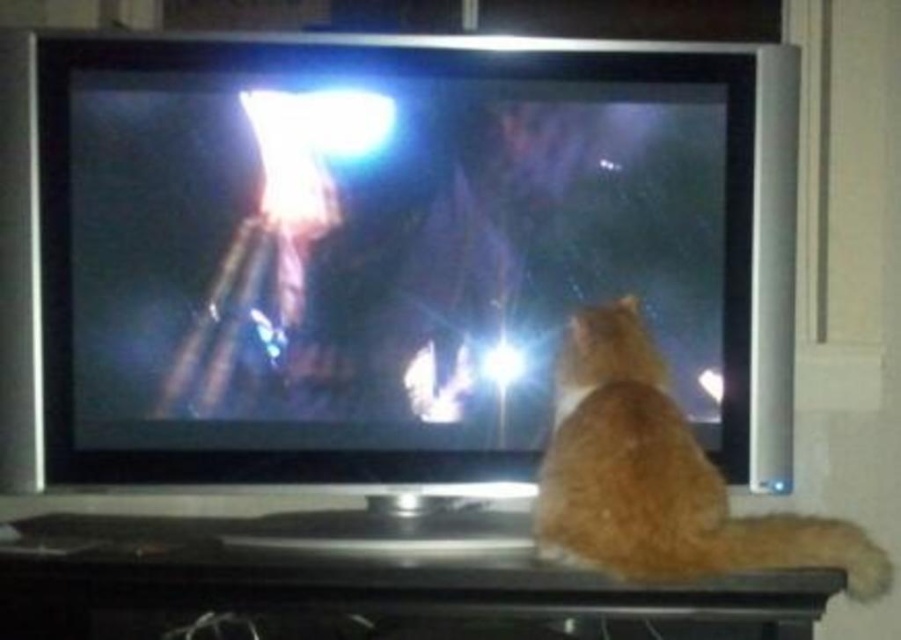
Question: Among these objects, which one is nearest to the camera?

Choices:
 (A) metallic silver flat at center
 (B) orange fur cat at lower right

Answer: (B)

Question: Among these points, which one is nearest to the camera?

Choices:
 (A) (623, 404)
 (B) (41, 419)

Answer: (A)

Question: Does metallic silver flat at center appear under orange fur cat at lower right?

Choices:
 (A) yes
 (B) no

Answer: (B)

Question: Does metallic silver flat at center have a larger size compared to orange fur cat at lower right?

Choices:
 (A) yes
 (B) no

Answer: (A)

Question: Is metallic silver flat at center below orange fur cat at lower right?

Choices:
 (A) no
 (B) yes

Answer: (A)

Question: Which point appears farthest from the camera in this image?

Choices:
 (A) (872, 573)
 (B) (481, 352)

Answer: (B)